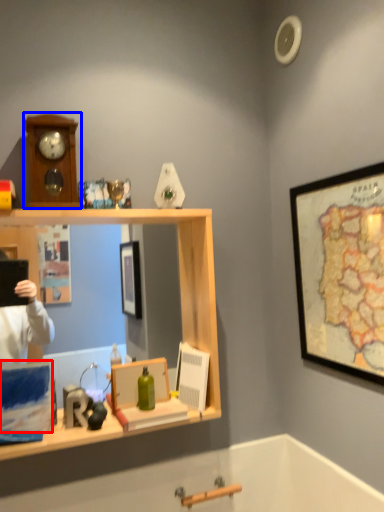
Question: Which of the following is the closest to the observer, box (highlighted by a red box) or clock (highlighted by a blue box)?

Choices:
 (A) box
 (B) clock

Answer: (A)